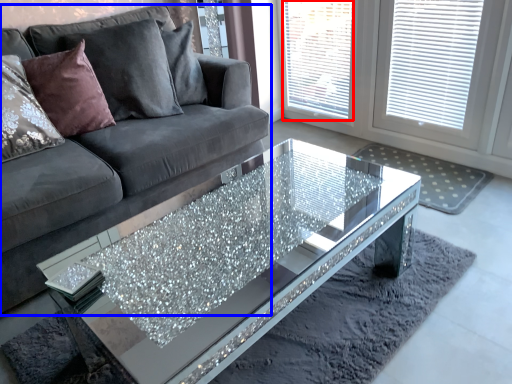
Question: Which object appears closest to the camera in this image, window screen (highlighted by a red box) or studio couch (highlighted by a blue box)?

Choices:
 (A) window screen
 (B) studio couch

Answer: (B)